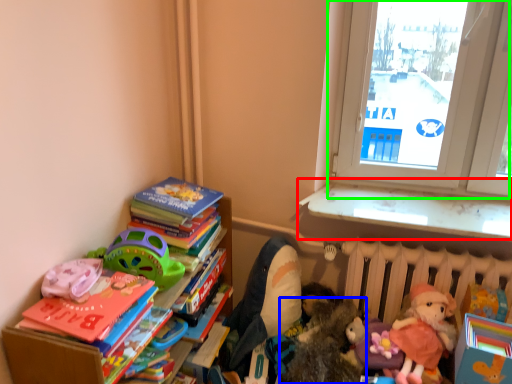
Question: Estimate the real-world distances between objects in this image. Which object is closer to window sill (highlighted by a red box), toy (highlighted by a blue box) or window (highlighted by a green box)?

Choices:
 (A) toy
 (B) window

Answer: (B)